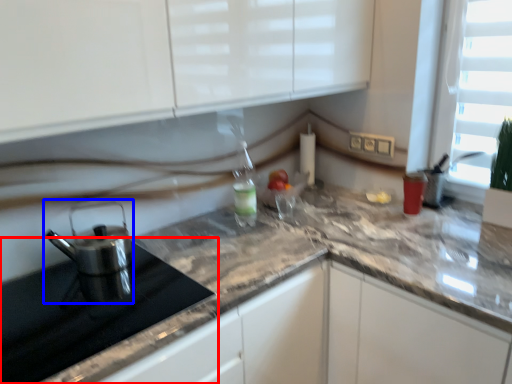
Question: Which of the following is the closest to the observer, appliance (highlighted by a red box) or kitchen appliance (highlighted by a blue box)?

Choices:
 (A) appliance
 (B) kitchen appliance

Answer: (A)